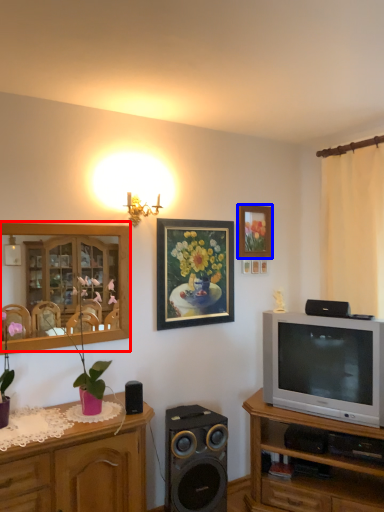
Question: Among these objects, which one is nearest to the camera, entertainment center (highlighted by a red box) or picture frame (highlighted by a blue box)?

Choices:
 (A) entertainment center
 (B) picture frame

Answer: (A)